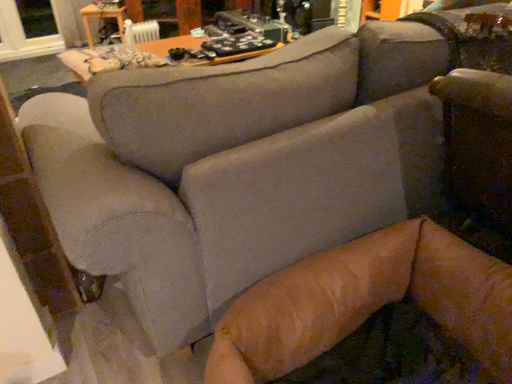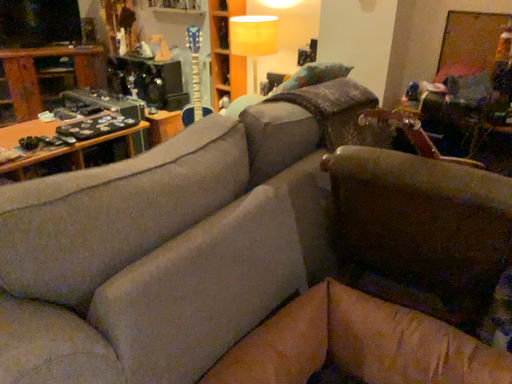
Question: How did the camera likely rotate when shooting the video?

Choices:
 (A) rotated downward
 (B) rotated upward

Answer: (B)